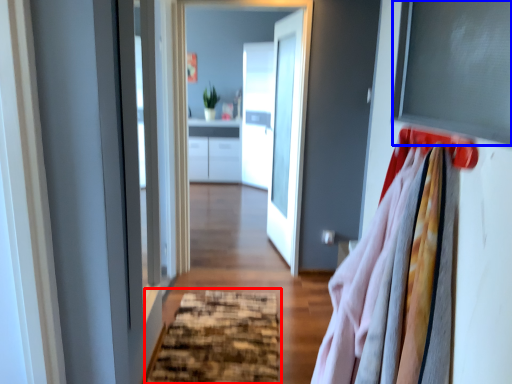
Question: Which object is closer to the camera taking this photo, doormat (highlighted by a red box) or window screen (highlighted by a blue box)?

Choices:
 (A) doormat
 (B) window screen

Answer: (B)